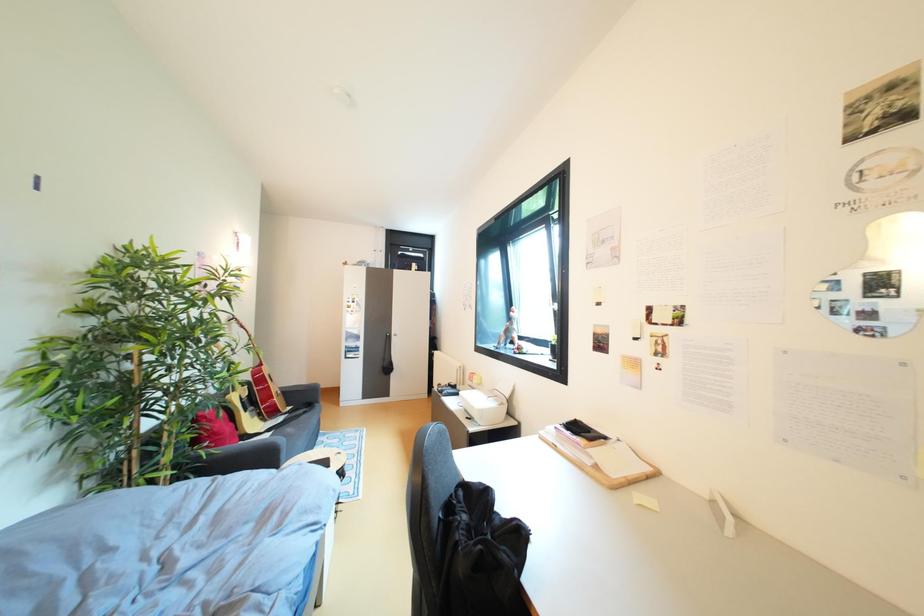
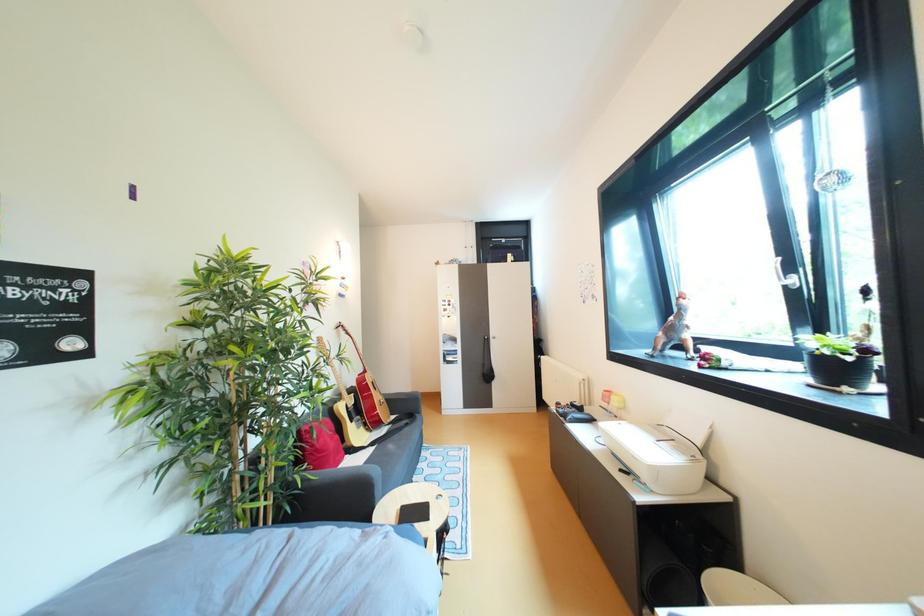
Question: The images are taken continuously from a first-person perspective. In which direction is your viewpoint rotating?

Choices:
 (A) Left
 (B) Right
 (C) Up
 (D) Down

Answer: (A)